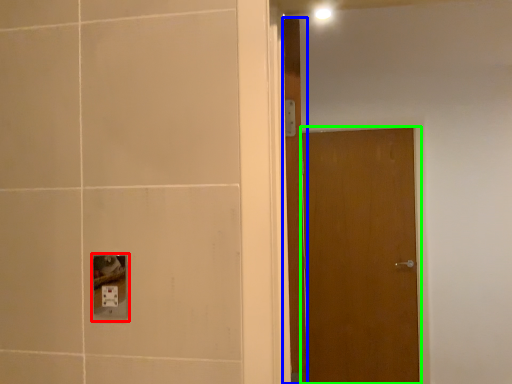
Question: Which is nearer to the socket (highlighted by a red box)? door (highlighted by a blue box) or door (highlighted by a green box).

Choices:
 (A) door
 (B) door

Answer: (A)